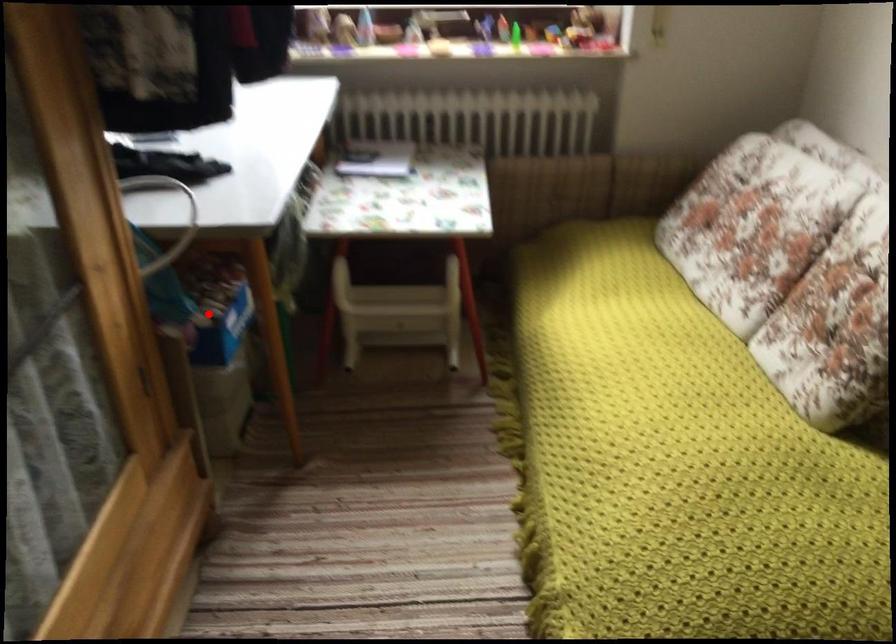
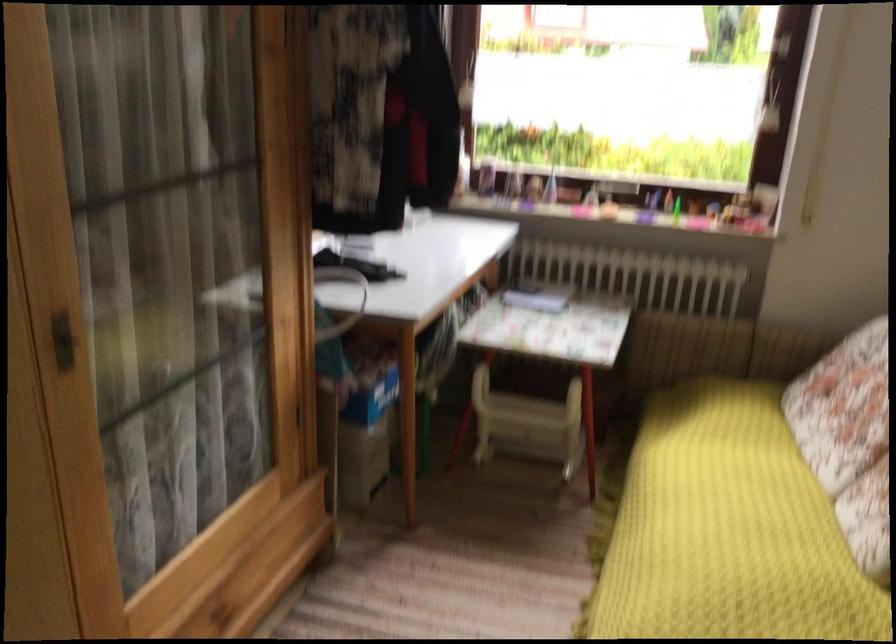
Question: I am providing you with two images of the same scene from different viewpoints. Given a red point in image1, look at the same physical point in image2. Is it:

Choices:
 (A) Closer to the viewpoint
 (B) Farther from the viewpoint

Answer: (B)